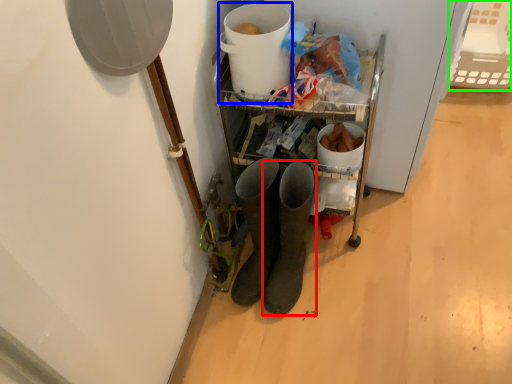
Question: Which object is positioned farthest from footwear (highlighted by a red box)? Select from appliance (highlighted by a blue box) and basket (highlighted by a green box).

Choices:
 (A) appliance
 (B) basket

Answer: (B)